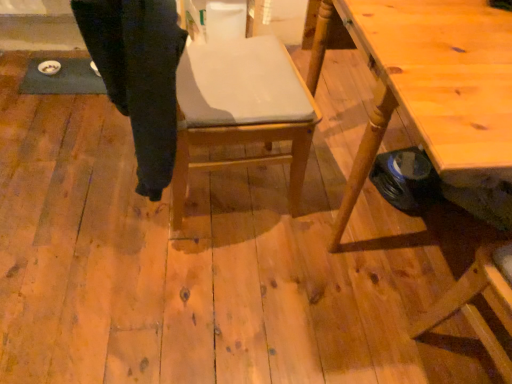
Where is `free space below wooden chair at center (from a real-world perspective)`? The image size is (512, 384). free space below wooden chair at center (from a real-world perspective) is located at coordinates (215, 188).